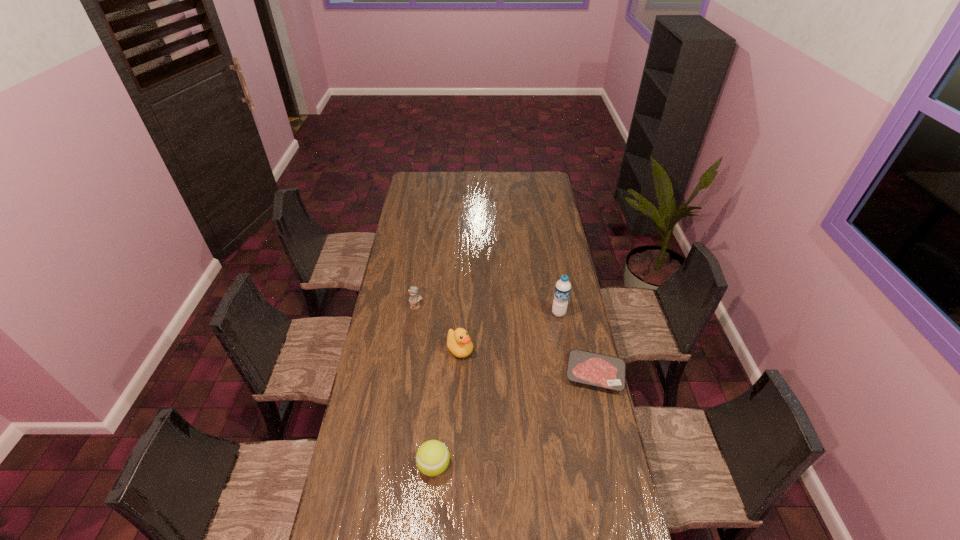
The height and width of the screenshot is (540, 960). I want to click on vacant space on the desktop that is between the tennis ball and the steak and is positioned on the label of the tallest object, so click(502, 427).

In order to click on vacant space on the desktop that is between the tennis ball and the shortest object and is positioned on the front-facing side of the teddy bear in this screenshot , I will do `click(515, 420)`.

This screenshot has height=540, width=960. Find the location of `vacant spot on the desktop that is between the tennis ball and the shortest object and is positioned at the beak of the second tallest object`. vacant spot on the desktop that is between the tennis ball and the shortest object and is positioned at the beak of the second tallest object is located at coordinates (527, 413).